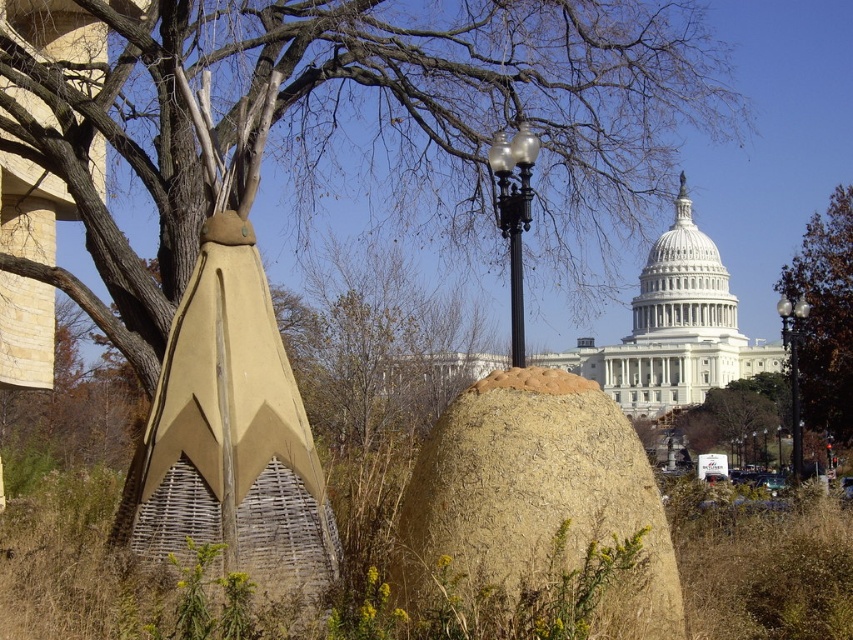
Can you confirm if brown textured mound at center is bigger than glass globe streetlight at center?

Yes, brown textured mound at center is bigger than glass globe streetlight at center.

The width and height of the screenshot is (853, 640). Describe the element at coordinates (537, 500) in the screenshot. I see `brown textured mound at center` at that location.

Where is `brown textured mound at center`? brown textured mound at center is located at coordinates (537, 500).

Is brown textured tree at upper right further to camera compared to metallic pole at center?

No, it is in front of metallic pole at center.

Is point (805, 413) less distant than point (767, 454)?

Yes, point (805, 413) is closer to viewer.

Identify the location of brown textured tree at upper right. (824, 316).

Consider the image. Does black metal streetlight at center have a larger size compared to glass globe streetlight at center?

Yes, black metal streetlight at center is bigger than glass globe streetlight at center.

Who is more distant from viewer, (529, 141) or (804, 308)?

The point (804, 308) is more distant.

Locate an element on the screen. The image size is (853, 640). black metal streetlight at center is located at coordinates (514, 216).